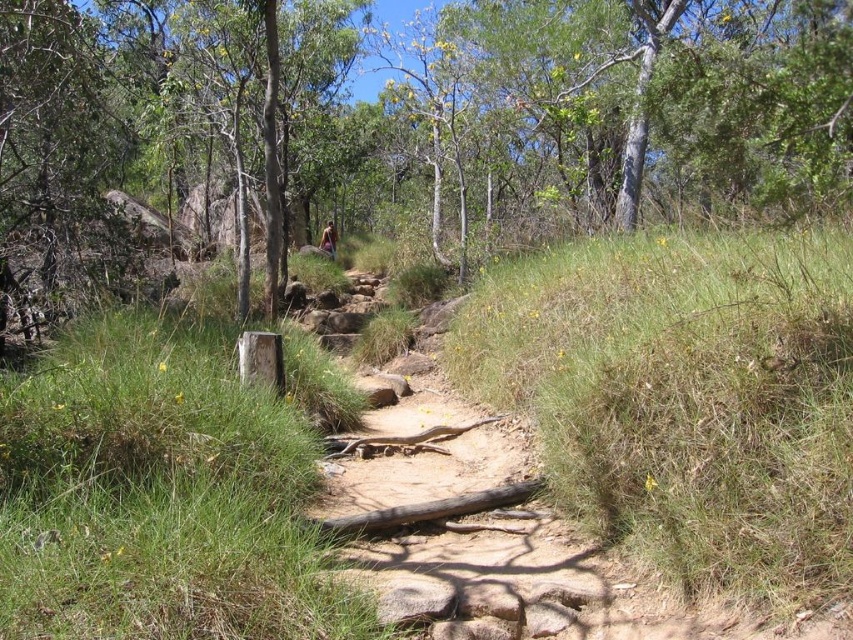
Question: From the image, what is the correct spatial relationship of green leafy tree at center in relation to brown leather jacket at center?

Choices:
 (A) right
 (B) left

Answer: (A)

Question: Which point is closer to the camera?

Choices:
 (A) green leafy tree at center
 (B) brown leather jacket at center

Answer: (A)

Question: Can you confirm if green leafy tree at center is positioned below brown leather jacket at center?

Choices:
 (A) no
 (B) yes

Answer: (A)

Question: Can you confirm if green leafy tree at center is positioned above brown leather jacket at center?

Choices:
 (A) yes
 (B) no

Answer: (A)